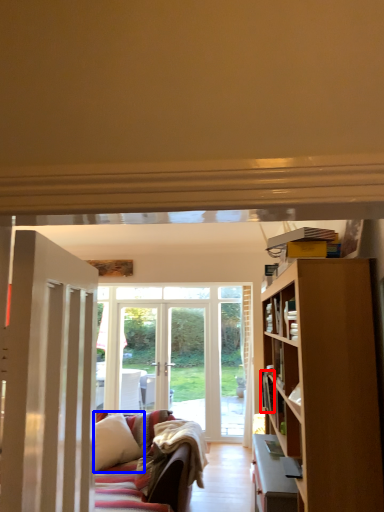
Question: Among these objects, which one is farthest to the camera, book (highlighted by a red box) or pillow (highlighted by a blue box)?

Choices:
 (A) book
 (B) pillow

Answer: (B)